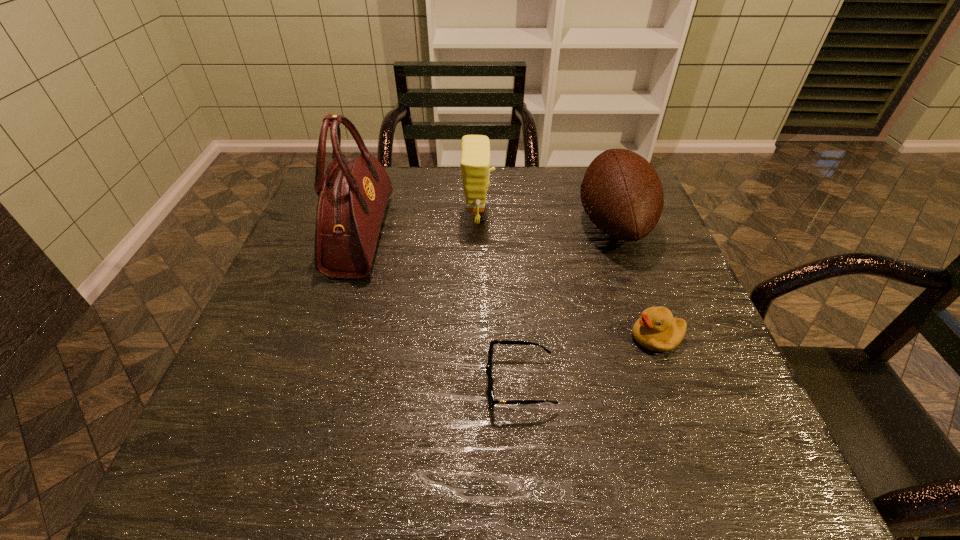
Identify which object is the second nearest to the sunglasses. Please provide its 2D coordinates. Your answer should be formatted as a tuple, i.e. [(x, y)], where the tuple contains the x and y coordinates of a point satisfying the conditions above.

[(622, 194)]